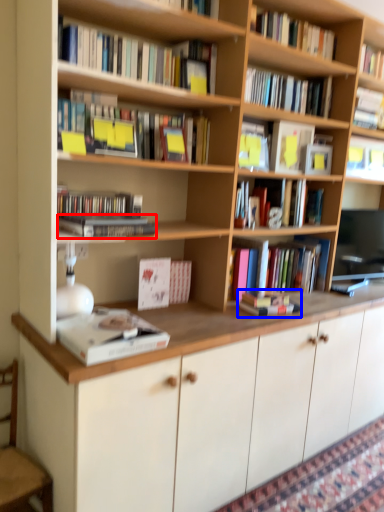
Question: Which point is further to the camera, book (highlighted by a red box) or book (highlighted by a blue box)?

Choices:
 (A) book
 (B) book

Answer: (B)